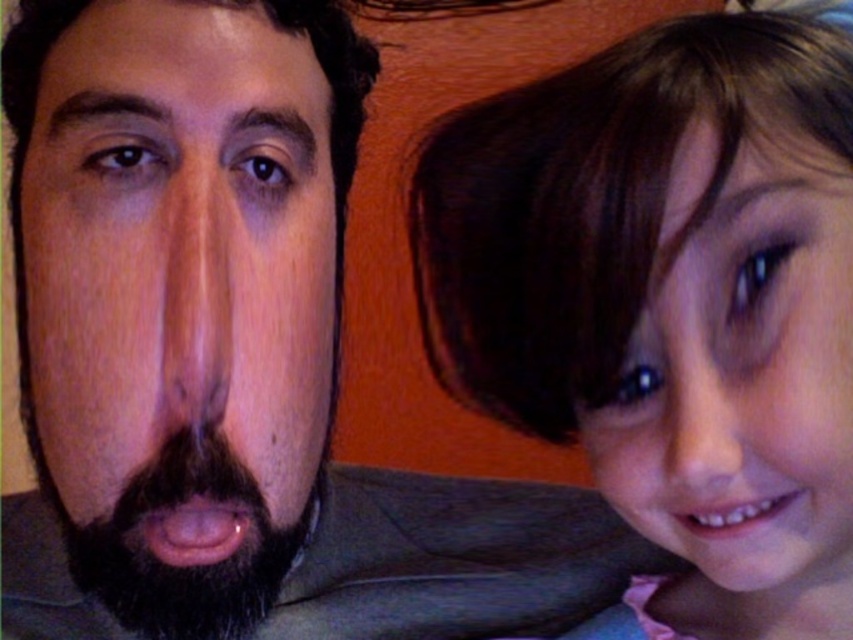
Which of these two, smooth brown hair at right or dark brown hair at upper right, stands shorter?

smooth brown hair at right

Who is higher up, smooth brown hair at right or dark brown hair at upper right?

dark brown hair at upper right is above.

Is point (627, 502) positioned before point (193, 0)?

That is True.

Locate an element on the screen. Image resolution: width=853 pixels, height=640 pixels. smooth brown hair at right is located at coordinates (666, 292).

Can you confirm if dark brown hair at upper right is shorter than smooth skin nose at right?

Incorrect, dark brown hair at upper right's height does not fall short of smooth skin nose at right's.

Between point (136, 216) and point (709, 408), which one is positioned in front?

Positioned in front is point (709, 408).

Who is more forward, (251,416) or (671,456)?

Point (671,456)

Where is `dark brown hair at upper right`? This screenshot has width=853, height=640. dark brown hair at upper right is located at coordinates (178, 301).

Can you confirm if dark brown hair at upper right is thinner than brown hair at upper right?

No.

Which is in front, point (225, 212) or point (718, 388)?

Point (718, 388) is more forward.

This screenshot has height=640, width=853. Find the location of `dark brown hair at upper right`. dark brown hair at upper right is located at coordinates (178, 301).